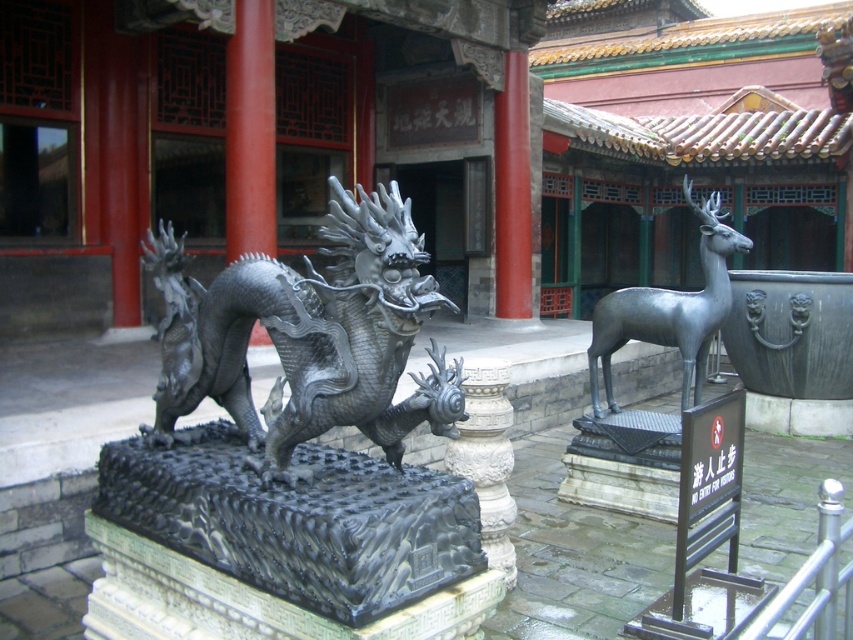
Who is positioned more to the left, polished silver deer at center right or white stone pillar at center?

Positioned to the left is white stone pillar at center.

Is polished silver deer at center right bigger than white stone pillar at center?

Indeed, polished silver deer at center right has a larger size compared to white stone pillar at center.

Which is behind, point (705, 333) or point (500, 413)?

The point (705, 333) is more distant.

Identify the location of polished silver deer at center right. (670, 308).

Can you confirm if polished silver dragon at center is positioned to the right of white stone pillar at center?

In fact, polished silver dragon at center is to the left of white stone pillar at center.

From the picture: Can you confirm if polished silver dragon at center is positioned below white stone pillar at center?

Incorrect, polished silver dragon at center is not positioned below white stone pillar at center.

The image size is (853, 640). I want to click on polished silver dragon at center, so click(x=309, y=337).

Is the position of polished silver dragon at center more distant than that of polished silver deer at center right?

No, polished silver dragon at center is closer to the viewer.

Which is below, polished silver dragon at center or polished silver deer at center right?

polished silver dragon at center

Which is in front, point (286, 424) or point (701, 324)?

Point (286, 424)

Image resolution: width=853 pixels, height=640 pixels. Find the location of `polished silver dragon at center`. polished silver dragon at center is located at coordinates (309, 337).